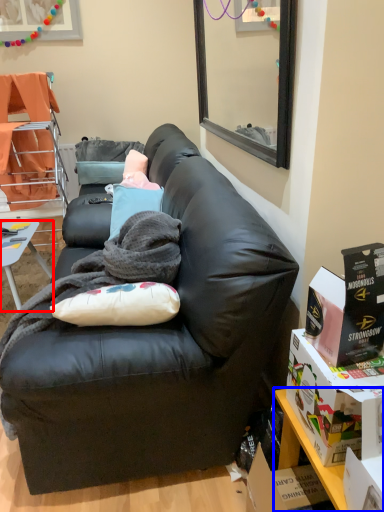
Question: Which of the following is the closest to the observer, desk (highlighted by a red box) or table (highlighted by a blue box)?

Choices:
 (A) desk
 (B) table

Answer: (B)